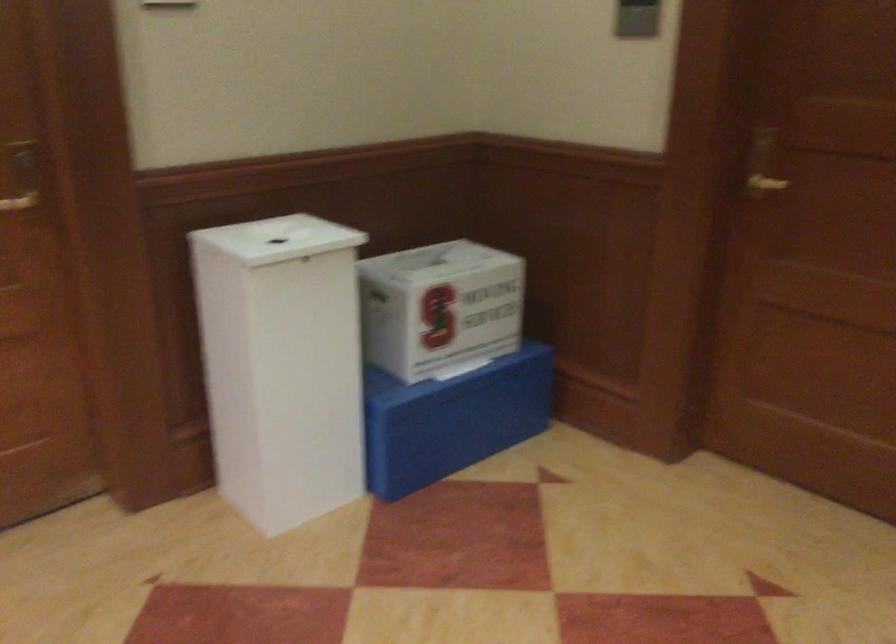
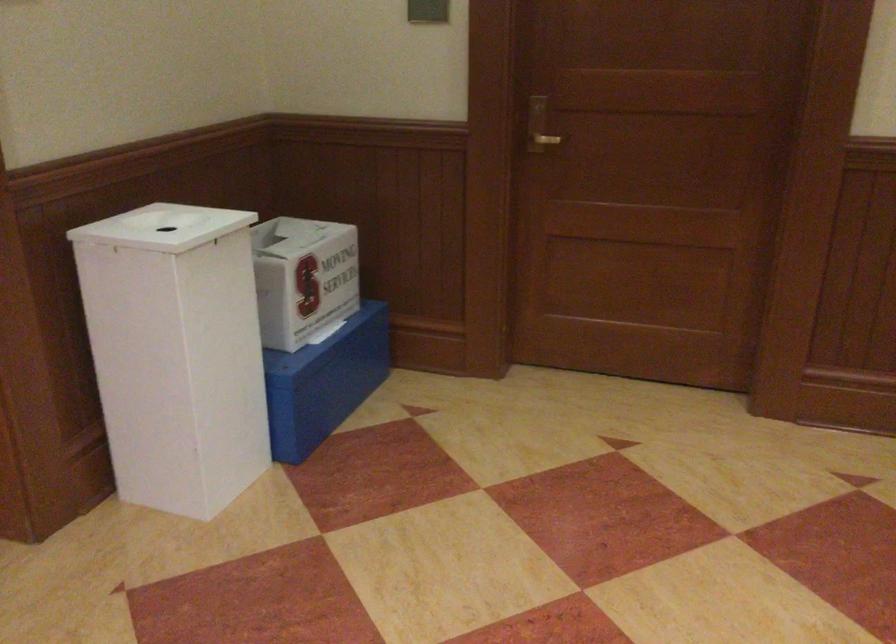
Locate, in the second image, the point that corresponds to point (250, 365) in the first image.

(176, 353)